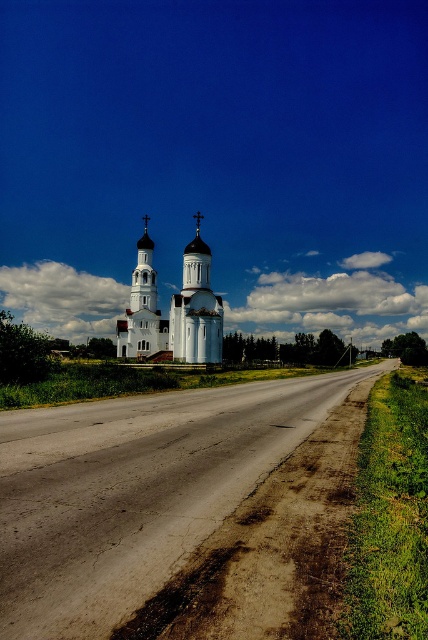
You are a hiker standing at the start of the road leading to the church. You want to know which occupies more space in the image between the brown dirt track at center and the white stone spire at center. Which one is it?

The white stone spire at center occupies more space than the brown dirt track at center in the image.

You are a tourist standing at the end of the road leading to the church. You want to take a photo of the white smooth church at center without the brown dirt track at center appearing in the frame. Is this possible given their positions?

The brown dirt track at center is positioned under the white smooth church at center, so if you position yourself so that the church is centered in your viewfinder, the dirt track will be directly beneath it. To exclude the track, you would need to angle your camera upward to frame only the church and sky, avoiding the lower portion where the track is located.

In the scene shown: You are standing at the beginning of the road leading to the church and want to walk towards the white stone spire at center. Which direction should you turn to face the white smooth church at center?

The white smooth church at center is to the right of the white stone spire at center, so to face it, you should turn to your right.